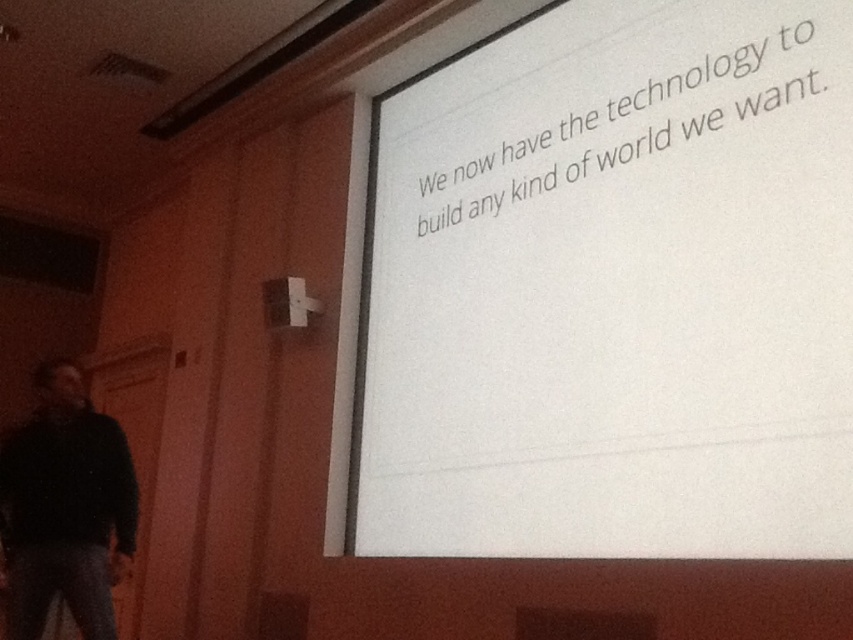
You are an attendee at the presentation. You see the point at coordinates (613, 291). What object is located at that point?

The point at coordinates (613, 291) corresponds to the white paper at upper center.

Based on the scene description, which object is wider between the white paper at upper center and the black matte jacket at lower left?

The white paper at upper center is wider than the black matte jacket at lower left according to the description.

You are an attendee at the presentation and want to see both the white paper at upper center and the black matte jacket at lower left clearly. Which one will you need to look upwards to see?

The white paper at upper center is located above the black matte jacket at lower left, so you will need to look upwards to see the white paper at upper center.